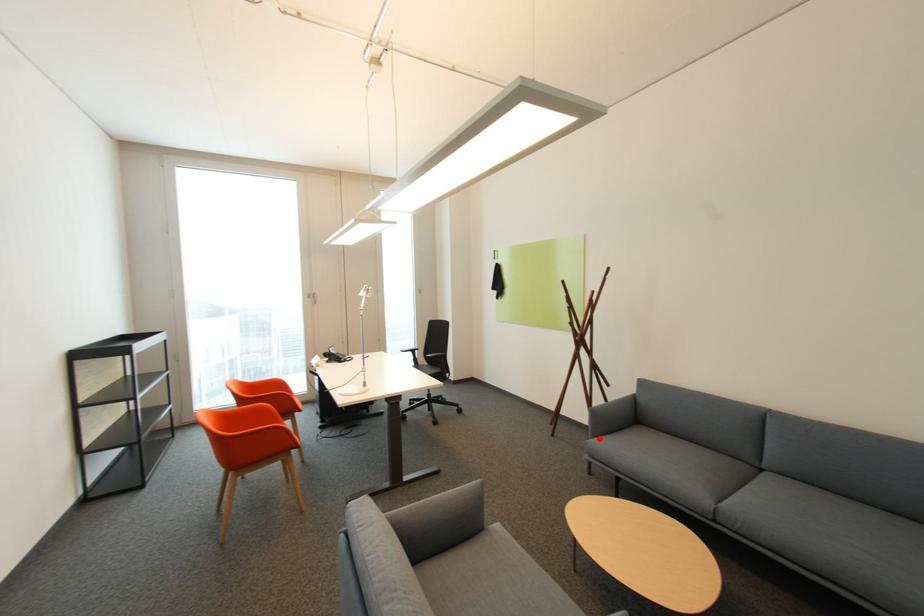
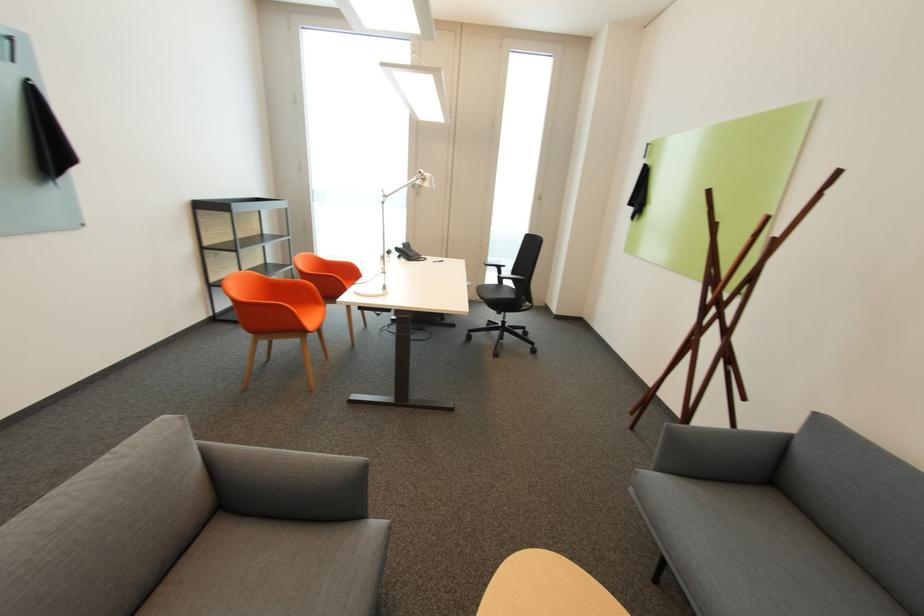
Question: A red point is marked in image1. In image2, is the corresponding 3D point closer to the camera or farther? Reply with the corresponding letter.

Choices:
 (A) The corresponding 3D point is closer.
 (B) The corresponding 3D point is farther.

Answer: (A)